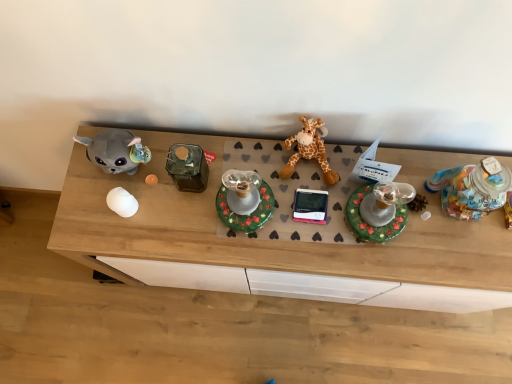
At what (x,y) coordinates should I click in order to perform the action: click on vacant space to the right of white glossy egg at center, acting as the 4th toy starting from the right. Please return your answer as a coordinate pair (x, y). Looking at the image, I should click on (177, 213).